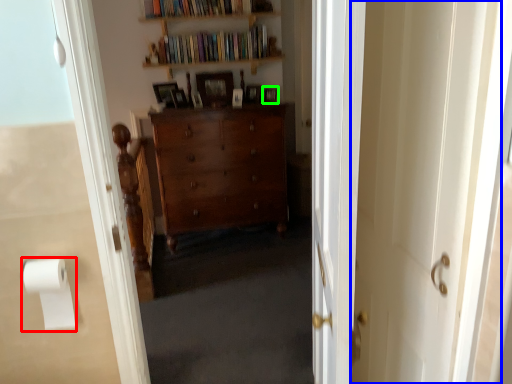
Question: Based on their relative distances, which object is farther from toilet paper (highlighted by a red box)? Choose from screen door (highlighted by a blue box) and picture frame (highlighted by a green box).

Choices:
 (A) screen door
 (B) picture frame

Answer: (B)